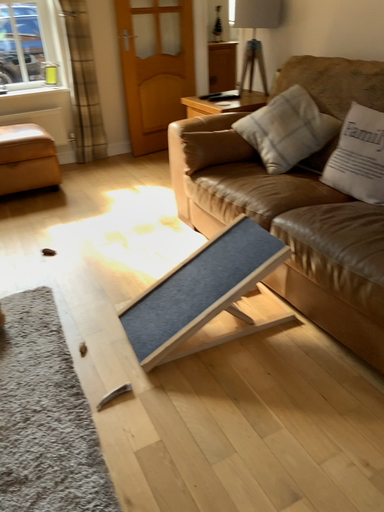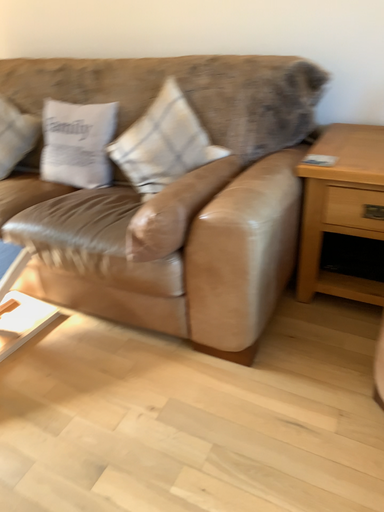
Question: Which way did the camera rotate in the video?

Choices:
 (A) rotated right
 (B) rotated left

Answer: (A)